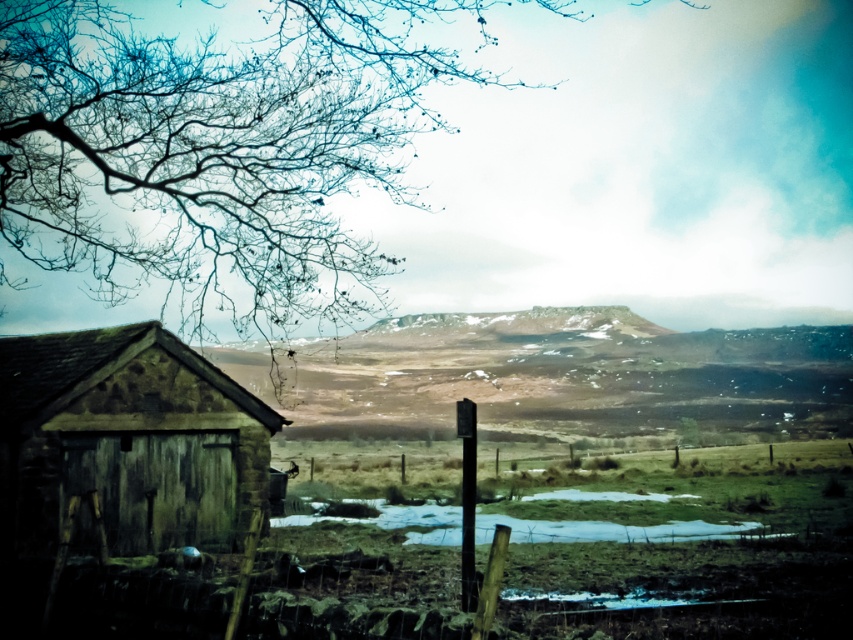
Who is shorter, bare branches at upper left or rustic wooden hut at left?

With less height is rustic wooden hut at left.

Does point (409, 42) come in front of point (26, 548)?

No.

Does point (13, 80) lie in front of point (138, 536)?

No, it is not.

In order to click on bare branches at upper left in this screenshot , I will do `click(218, 152)`.

Which of these two, bare branches at upper left or snowy rock formation at center, stands shorter?

Standing shorter between the two is snowy rock formation at center.

Does bare branches at upper left appear over snowy rock formation at center?

Indeed, bare branches at upper left is positioned over snowy rock formation at center.

Locate an element on the screen. Image resolution: width=853 pixels, height=640 pixels. bare branches at upper left is located at coordinates pyautogui.click(x=218, y=152).

The height and width of the screenshot is (640, 853). I want to click on bare branches at upper left, so click(x=218, y=152).

The image size is (853, 640). I want to click on snowy rock formation at center, so click(x=558, y=378).

Who is higher up, snowy rock formation at center or rustic wooden hut at left?

rustic wooden hut at left is higher up.

Identify the location of snowy rock formation at center. This screenshot has width=853, height=640. (558, 378).